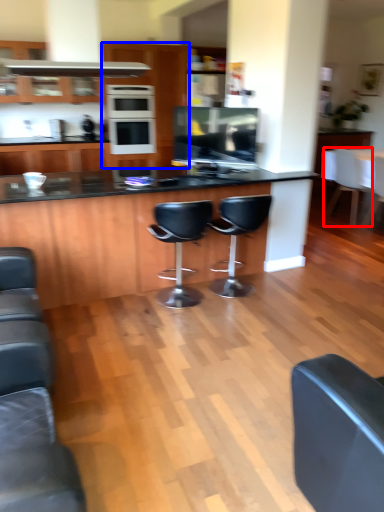
Question: Which object is closer to the camera taking this photo, chair (highlighted by a red box) or cabinetry (highlighted by a blue box)?

Choices:
 (A) chair
 (B) cabinetry

Answer: (A)